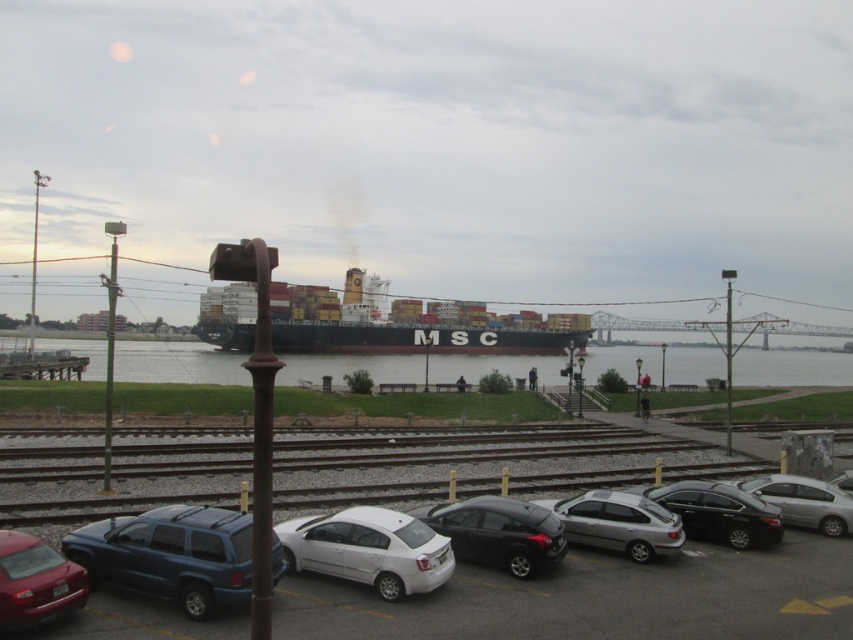
Based on the photo, you are a delivery driver who needs to park your truck in the parking lot. You see the matte blue suv at lower left and the silver metallic sedan at center. Which vehicle is blocking your path to the parking spot?

The matte blue suv at lower left is positioned over the silver metallic sedan at center, so the matte blue suv at lower left is blocking the path to the parking spot.

You are a delivery driver who needs to park your truck in this parking lot. You see the metallic silver car at lower center and the matte blue suv at lower left. Which vehicle takes up more space in the parking lot?

The metallic silver car at lower center takes up more space in the parking lot because it has a larger size compared to the matte blue suv at lower left.